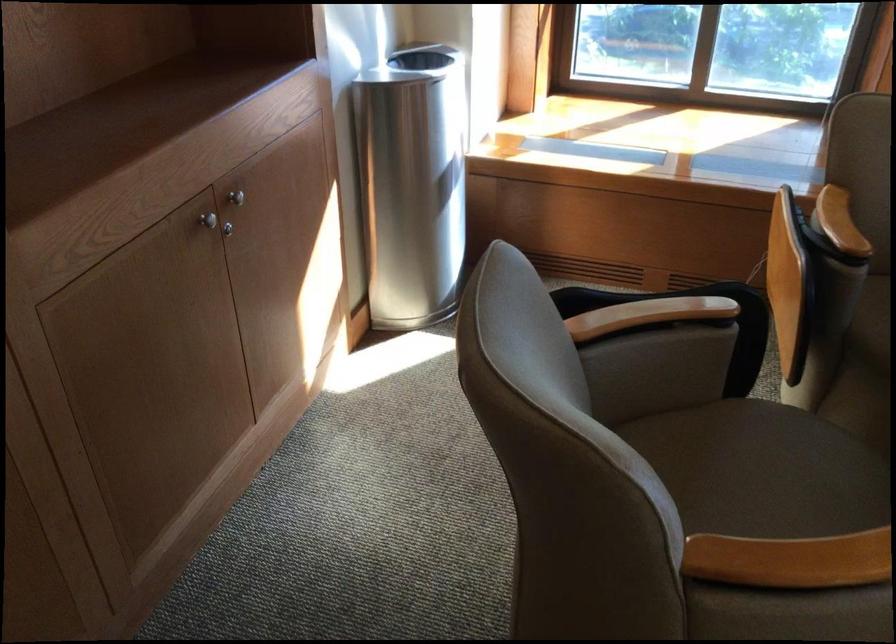
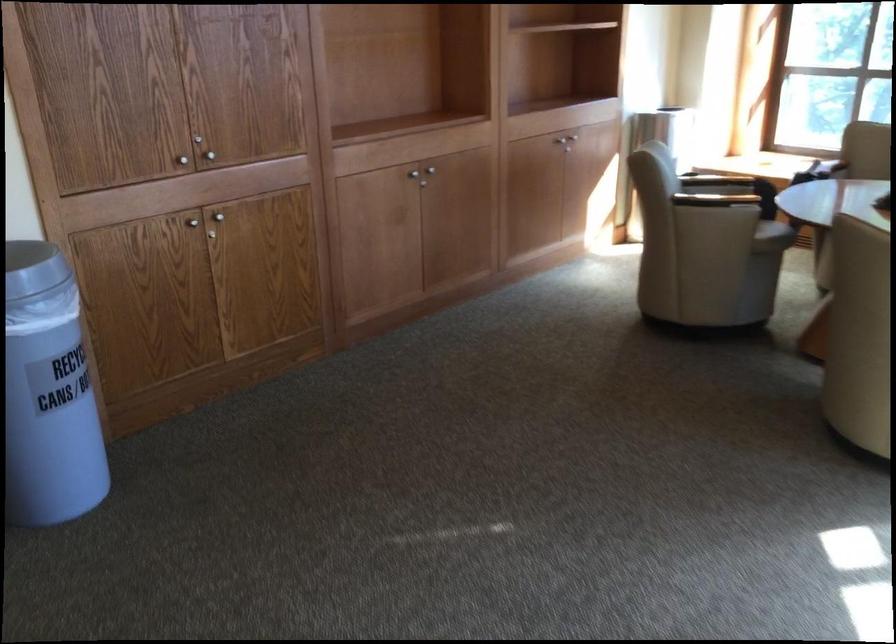
Question: I am providing you with two images of the same scene from different viewpoints. Please identify which objects are invisible in image2.

Choices:
 (A) chair sitting surface
 (B) chair armrest
 (C) grey trash can
 (D) wire drawer handle

Answer: (A)